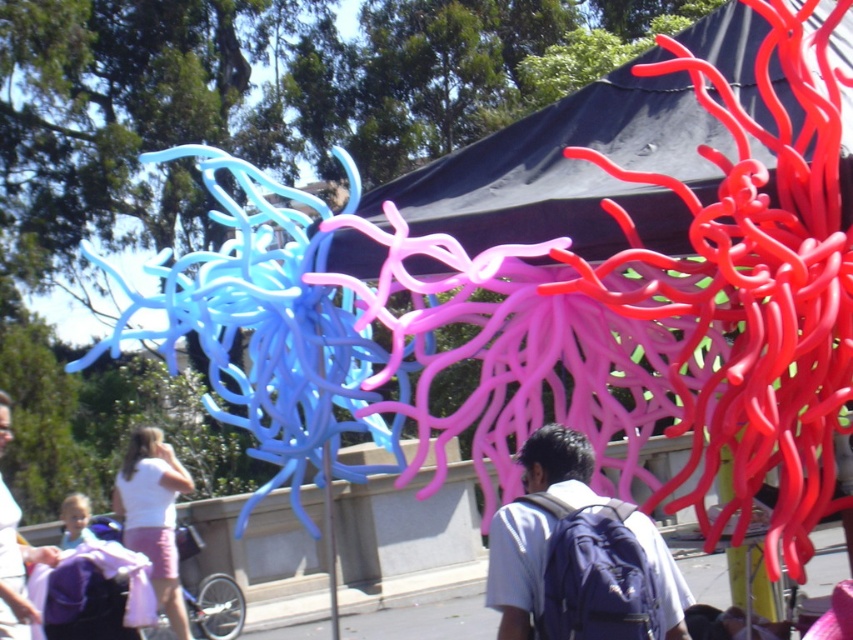
Question: From the image, what is the correct spatial relationship of black fabric canopy at upper center in relation to white cotton shirt at lower left?

Choices:
 (A) above
 (B) below

Answer: (A)

Question: Is black fabric canopy at upper center wider than purple fabric backpack at center?

Choices:
 (A) no
 (B) yes

Answer: (A)

Question: Can you confirm if black fabric canopy at upper center is thinner than purple fabric backpack at center?

Choices:
 (A) yes
 (B) no

Answer: (A)

Question: Which of these objects is positioned farthest from the black fabric canopy at upper center?

Choices:
 (A) purple fabric backpack at center
 (B) white cotton shirt at lower left

Answer: (B)

Question: Which object is positioned farthest from the white cotton shirt at lower left?

Choices:
 (A) black fabric canopy at upper center
 (B) purple fabric backpack at center

Answer: (B)

Question: Estimate the real-world distances between objects in this image. Which object is farther from the white cotton shirt at lower left?

Choices:
 (A) black fabric canopy at upper center
 (B) purple fabric backpack at center

Answer: (B)